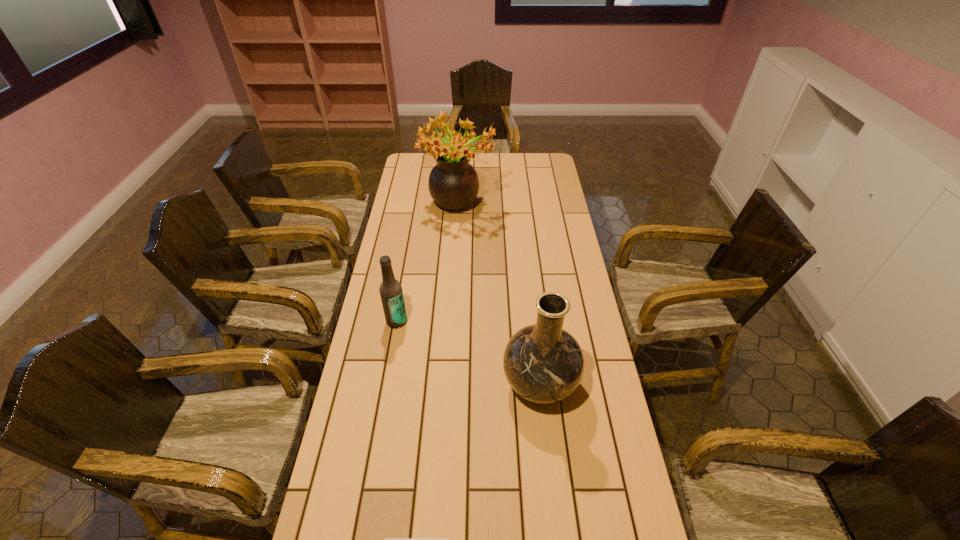
Find the location of a particular element. The height and width of the screenshot is (540, 960). the farthest object is located at coordinates tap(453, 183).

At what (x,y) coordinates should I click in order to perform the action: click on vase. Please return your answer as a coordinate pair (x, y). This screenshot has width=960, height=540. Looking at the image, I should click on (543, 363).

At what (x,y) coordinates should I click in order to perform the action: click on the rightmost object. Please return your answer as a coordinate pair (x, y). The width and height of the screenshot is (960, 540). Looking at the image, I should click on (543, 363).

Identify the location of the third tallest object. The width and height of the screenshot is (960, 540). (391, 293).

Find the location of a particular element. beer bottle is located at coordinates (391, 293).

In order to click on vacant area situated 0.280m on the right of the flower arrangement in this screenshot , I will do `click(557, 207)`.

You are a GUI agent. You are given a task and a screenshot of the screen. Output one action in this format:
    pyautogui.click(x=<x>, y=<y>)
    Task: Click on the vacant space located 0.380m on the back of the second nearest object
    
    Given the screenshot: What is the action you would take?
    pyautogui.click(x=527, y=272)

I want to click on vacant space located 0.100m on the side of the beer bottle with the label, so click(x=391, y=354).

You are a GUI agent. You are given a task and a screenshot of the screen. Output one action in this format:
    pyautogui.click(x=<x>, y=<y>)
    Task: Click on the flower arrangement situated at the left edge
    This screenshot has width=960, height=540.
    Given the screenshot: What is the action you would take?
    pyautogui.click(x=453, y=183)

This screenshot has height=540, width=960. I want to click on beer bottle situated at the left edge, so click(391, 293).